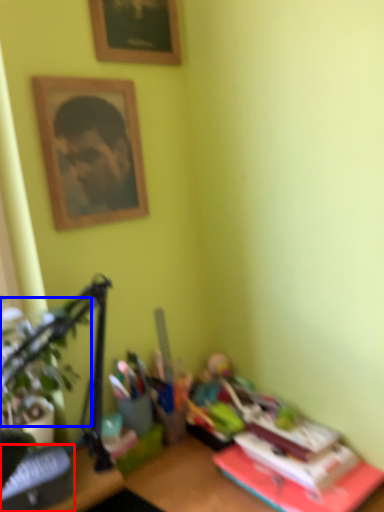
Question: Which of the following is the farthest to the observer, paperback book (highlighted by a red box) or plant (highlighted by a blue box)?

Choices:
 (A) paperback book
 (B) plant

Answer: (A)